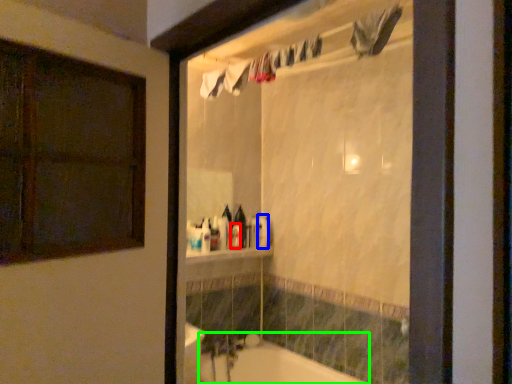
Question: Based on their relative distances, which object is nearer to toiletry (highlighted by a red box)? Choose from toiletry (highlighted by a blue box) and bathtub (highlighted by a green box).

Choices:
 (A) toiletry
 (B) bathtub

Answer: (A)